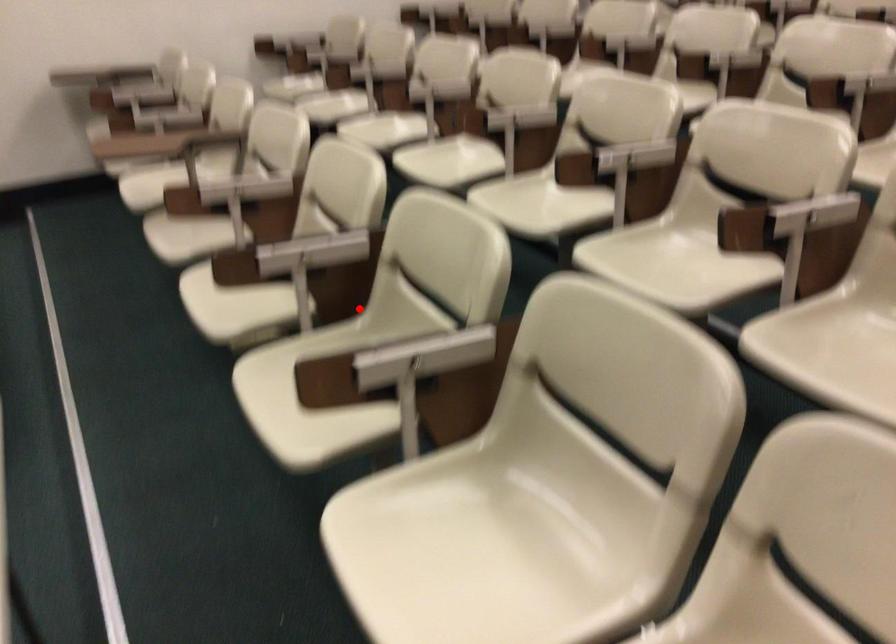
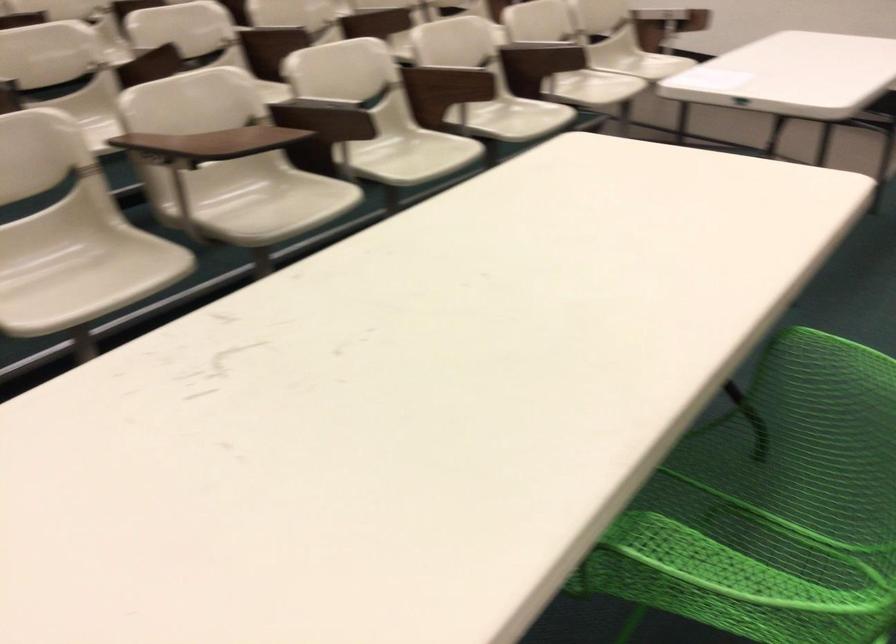
Question: I am providing you with two images of the same scene from different viewpoints. In image1, a red point is highlighted. Considering the same 3D point in image2, which of the following is correct?

Choices:
 (A) It is closer
 (B) It is farther

Answer: (B)